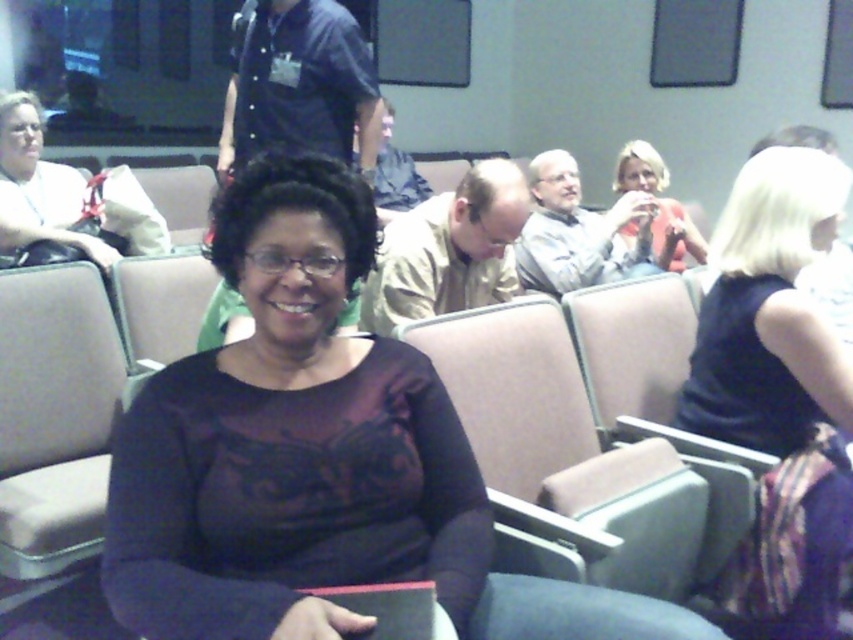
You are a photographer adjusting your camera settings to capture a group photo. You notice the dark purple satin blouse at center and the black fabric dress at right. To ensure both are in focus, what is the minimum distance your camera should be set to focus at?

The dark purple satin blouse at center is 39.22 inches from the black fabric dress at right. Therefore, the camera should be set to focus at a distance of at least 39.22 inches to ensure both are in focus.

You are a photographer taking a picture of the dark purple satin blouse at center and the black fabric dress at right. Which one will appear larger in the photo?

The black fabric dress at right will appear larger in the photo because the dark purple satin blouse at center has a smaller size compared to it.